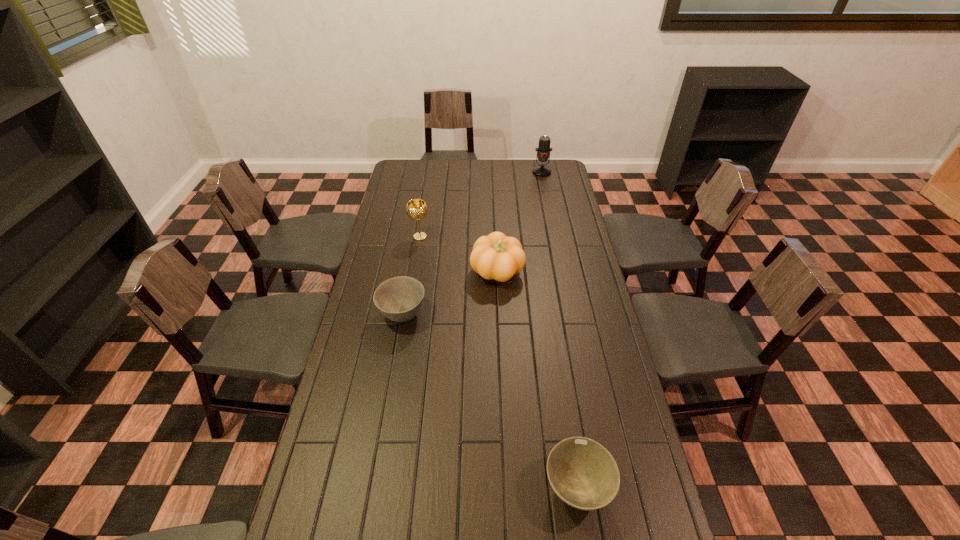
Find the location of `free region at the right edge`. free region at the right edge is located at coordinates click(x=590, y=334).

Where is `free space at the far left corner of the desktop`? This screenshot has width=960, height=540. free space at the far left corner of the desktop is located at coordinates (403, 167).

Find the location of a particular element. The image size is (960, 540). free space that is in between the fourth farthest object and the right bowl is located at coordinates (490, 401).

You are a GUI agent. You are given a task and a screenshot of the screen. Output one action in this format:
    pyautogui.click(x=<x>, y=<y>)
    Task: Click on the vacant area between the left bowl and the farthest object
    
    Given the screenshot: What is the action you would take?
    pyautogui.click(x=472, y=243)

Where is `free space between the second farthest object and the fourth farthest object`? free space between the second farthest object and the fourth farthest object is located at coordinates (411, 275).

At what (x,y) coordinates should I click in order to perform the action: click on vacant space in between the left bowl and the right bowl. Please return your answer as a coordinate pair (x, y). This screenshot has height=540, width=960. Looking at the image, I should click on (x=490, y=401).

This screenshot has height=540, width=960. Identify the location of empty space between the fourth farthest object and the third farthest object. (449, 293).

This screenshot has height=540, width=960. Identify the location of vacant space that's between the third farthest object and the fourth farthest object. (449, 293).

Identify the location of free space between the chalice and the farthest object. (481, 204).

Where is `vacant area between the nearest object and the farthest object`? This screenshot has height=540, width=960. vacant area between the nearest object and the farthest object is located at coordinates (560, 329).